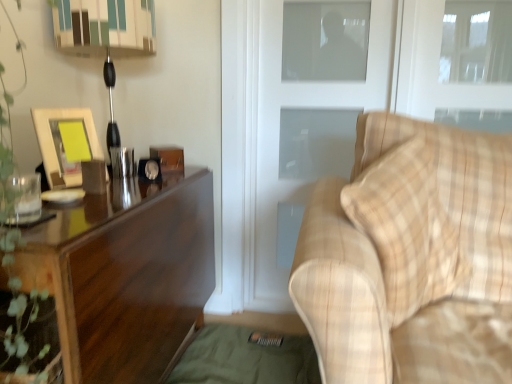
What do you see at coordinates (457, 63) in the screenshot?
I see `transparent glass window at upper right` at bounding box center [457, 63].

The width and height of the screenshot is (512, 384). What do you see at coordinates (106, 36) in the screenshot? I see `metallic black table lamp at left` at bounding box center [106, 36].

What do you see at coordinates (304, 148) in the screenshot? I see `white frosted glass screen door at center` at bounding box center [304, 148].

Where is `transparent glass window at upper right`? The image size is (512, 384). transparent glass window at upper right is located at coordinates (457, 63).

Is white frosted glass screen door at center turned away from dark wood desk at left?

No, white frosted glass screen door at center's orientation is not away from dark wood desk at left.

How many degrees apart are the facing directions of white frosted glass screen door at center and dark wood desk at left?

There is a 89.1-degree angle between the facing directions of white frosted glass screen door at center and dark wood desk at left.

This screenshot has height=384, width=512. What are the coordinates of `desk in front of the white frosted glass screen door at center` in the screenshot? It's located at (126, 274).

Is white frosted glass screen door at center inside the boundaries of dark wood desk at left, or outside?

The correct answer is: outside.

Considering the positions of point (37, 125) and point (109, 332), is point (37, 125) closer or farther from the camera than point (109, 332)?

Point (37, 125) is farther from the camera than point (109, 332).

Which object is closer to the camera, matte wooden picture frame at left or dark wood desk at left?

dark wood desk at left is more forward.

Considering the sizes of matte wooden picture frame at left and dark wood desk at left in the image, is matte wooden picture frame at left wider or thinner than dark wood desk at left?

In the image, matte wooden picture frame at left appears to be more narrow than dark wood desk at left.

Is matte wooden picture frame at left to the left of dark wood desk at left from the viewer's perspective?

Correct, you'll find matte wooden picture frame at left to the left of dark wood desk at left.

Does white frosted glass screen door at center have a smaller size compared to plaid fabric couch at right?

Yes, white frosted glass screen door at center is smaller than plaid fabric couch at right.

Does white frosted glass screen door at center have a greater width compared to plaid fabric couch at right?

No.

Looking at this image, considering the relative sizes of white frosted glass screen door at center and plaid fabric couch at right in the image provided, is white frosted glass screen door at center taller than plaid fabric couch at right?

Yes.

Are white frosted glass screen door at center and plaid fabric couch at right beside each other?

No, white frosted glass screen door at center is not beside plaid fabric couch at right.

From a real-world perspective, between matte wooden picture frame at left and transparent glass window at upper right, who is vertically higher?

In real-world perspective, transparent glass window at upper right is above.

Considering the sizes of matte wooden picture frame at left and transparent glass window at upper right in the image, is matte wooden picture frame at left wider or thinner than transparent glass window at upper right?

Clearly, matte wooden picture frame at left has more width compared to transparent glass window at upper right.

Is matte wooden picture frame at left at the left side of transparent glass window at upper right?

Indeed, matte wooden picture frame at left is positioned on the left side of transparent glass window at upper right.

Would you consider matte wooden picture frame at left to be distant from white frosted glass screen door at center?

That's not correct — matte wooden picture frame at left is a little close to white frosted glass screen door at center.

From the image's perspective, is matte wooden picture frame at left positioned above or below white frosted glass screen door at center?

matte wooden picture frame at left is situated higher than white frosted glass screen door at center in the image.

From the picture: Relative to white frosted glass screen door at center, is matte wooden picture frame at left in front or behind?

Visually, matte wooden picture frame at left is located in front of white frosted glass screen door at center.

From the image's perspective, is plaid fabric couch at right above or below matte wooden picture frame at left?

Clearly, from the image's perspective, plaid fabric couch at right is below matte wooden picture frame at left.

Is plaid fabric couch at right taller or shorter than matte wooden picture frame at left?

Considering their sizes, plaid fabric couch at right has more height than matte wooden picture frame at left.

Is plaid fabric couch at right in front of or behind matte wooden picture frame at left in the image?

Visually, plaid fabric couch at right is located in front of matte wooden picture frame at left.

Can you confirm if plaid fabric couch at right is wider than matte wooden picture frame at left?

Yes.

From a real-world perspective, between dark wood desk at left and matte wooden picture frame at left, who is vertically lower?

dark wood desk at left.

Who is more distant, dark wood desk at left or matte wooden picture frame at left?

matte wooden picture frame at left is behind.

Is dark wood desk at left wider than matte wooden picture frame at left?

Correct, the width of dark wood desk at left exceeds that of matte wooden picture frame at left.

From the picture: Could you tell me if dark wood desk at left is turned towards matte wooden picture frame at left?

No.

Find the location of a particular element. The height and width of the screenshot is (384, 512). screen door above the dark wood desk at left (from a real-world perspective) is located at coordinates (304, 148).

The width and height of the screenshot is (512, 384). In order to click on desk that appears in front of the matte wooden picture frame at left in this screenshot , I will do `click(126, 274)`.

From the image, which object appears to be nearer to dark wood desk at left, metallic black table lamp at left or white frosted glass screen door at center?

white frosted glass screen door at center lies closer to dark wood desk at left than the other object.

Based on their spatial positions, is transparent glass window at upper right or dark wood desk at left further from matte wooden picture frame at left?

transparent glass window at upper right.

Estimate the real-world distances between objects in this image. Which object is further from dark wood desk at left, matte wooden picture frame at left or metallic black table lamp at left?

Based on the image, metallic black table lamp at left appears to be further to dark wood desk at left.

Estimate the real-world distances between objects in this image. Which object is further from plaid fabric couch at right, transparent glass window at upper right or white frosted glass screen door at center?

white frosted glass screen door at center is positioned further to the anchor plaid fabric couch at right.

Based on the photo, considering their positions, is dark wood desk at left positioned closer to transparent glass window at upper right than metallic black table lamp at left?

dark wood desk at left.

When comparing their distances from metallic black table lamp at left, does plaid fabric couch at right or dark wood desk at left seem closer?

dark wood desk at left is closer to metallic black table lamp at left.

From the image, which object appears to be farther from white frosted glass screen door at center, metallic black table lamp at left or dark wood desk at left?

dark wood desk at left is further to white frosted glass screen door at center.

Which object lies further to the anchor point metallic black table lamp at left, matte wooden picture frame at left or dark wood desk at left?

Based on the image, dark wood desk at left appears to be further to metallic black table lamp at left.

Image resolution: width=512 pixels, height=384 pixels. Find the location of `table lamp situated between matte wooden picture frame at left and transparent glass window at upper right from left to right`. table lamp situated between matte wooden picture frame at left and transparent glass window at upper right from left to right is located at coordinates (106, 36).

The width and height of the screenshot is (512, 384). What are the coordinates of `desk between plaid fabric couch at right and white frosted glass screen door at center in the front-back direction` in the screenshot? It's located at (126, 274).

I want to click on screen door between metallic black table lamp at left and transparent glass window at upper right in the horizontal direction, so click(304, 148).

Identify the location of window between plaid fabric couch at right and white frosted glass screen door at center in the front-back direction. (457, 63).